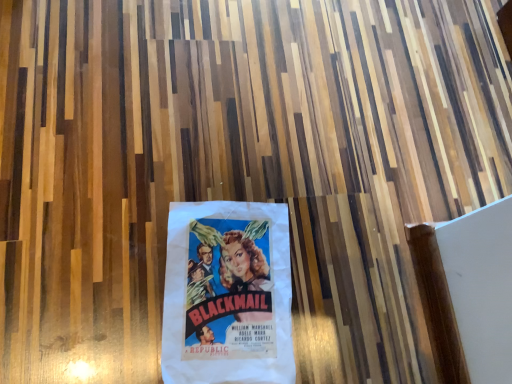
Where is `empty space that is ontop of white paper poster at center (from a real-world perspective)`? The height and width of the screenshot is (384, 512). empty space that is ontop of white paper poster at center (from a real-world perspective) is located at coordinates (227, 290).